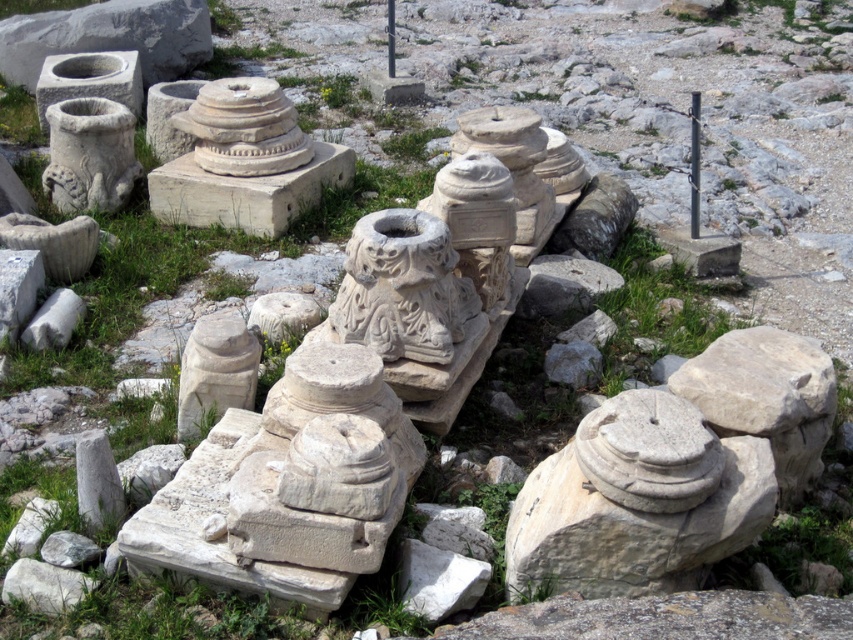
Is white stone sculpture at center thinner than white stone pillar at center?

In fact, white stone sculpture at center might be wider than white stone pillar at center.

Looking at this image, who is positioned more to the left, white stone sculpture at center or white stone pillar at center?

white stone sculpture at center is more to the left.

I want to click on white stone sculpture at center, so click(402, 289).

The image size is (853, 640). In order to click on white stone sculpture at center in this screenshot , I will do `click(402, 289)`.

The height and width of the screenshot is (640, 853). I want to click on white stone pillar at center, so click(694, 163).

Can you confirm if white stone pillar at center is positioned above white stone column at center?

No.

Measure the distance between white stone pillar at center and camera.

They are 7.74 meters apart.

At what (x,y) coordinates should I click in order to perform the action: click on white stone pillar at center. Please return your answer as a coordinate pair (x, y). Looking at the image, I should click on (694, 163).

Between point (10, 54) and point (392, 67), which one is positioned behind?

The point (392, 67) is behind.

You are a GUI agent. You are given a task and a screenshot of the screen. Output one action in this format:
    pyautogui.click(x=<x>, y=<y>)
    Task: Click on the white stone basin at upper left
    
    Given the screenshot: What is the action you would take?
    pyautogui.click(x=109, y=36)